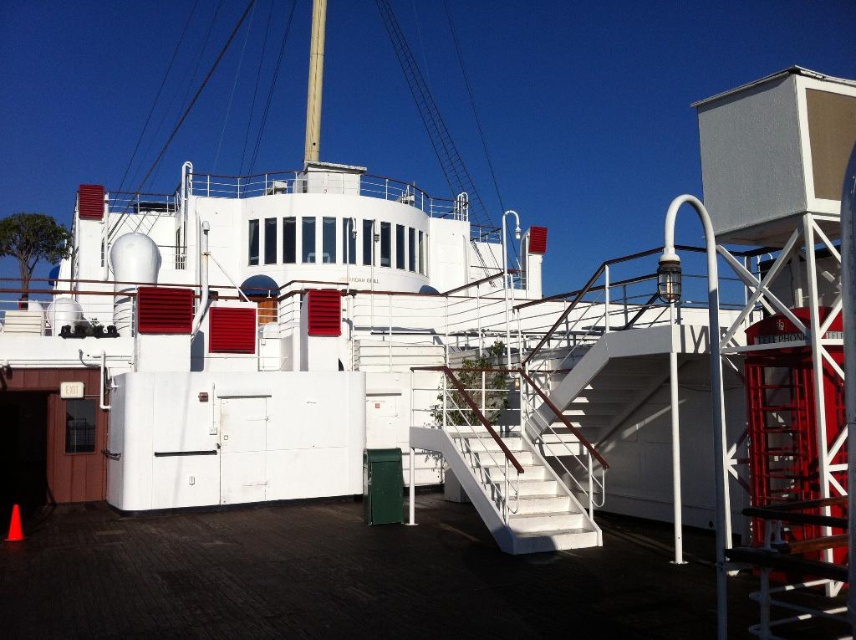
You are standing on the ship deck and see two points marked on the deck. The first point is at coordinates point [531,522] and the second is at point [310,138]. If you want to walk from the first point to the second point, which direction should you move relative to the ship?

You should move backward because point [531,522] is in front of point [310,138]. Since you are at the first point, moving backward will take you towards the second point.

You are standing on the deck of the ship and need to determine the spatial relationship between the dark brown wood at lower center and the smooth white mast at center. Which object is wider?

The dark brown wood at lower center is wider than the smooth white mast at center.

You are a crew member on the ship and need to move a heavy crate from the lower deck to the upper deck. The crate is 1.2 meters wide. Can the crate fit through the space between the white glossy staircase at center and the smooth white mast at center?

The white glossy staircase at center is thinner than the smooth white mast at center. Since the staircase is thinner, the space between them is at least as wide as the mast. The crate is 1.2 meters wide, so it should fit through the space between the white glossy staircase at center and the smooth white mast at center.